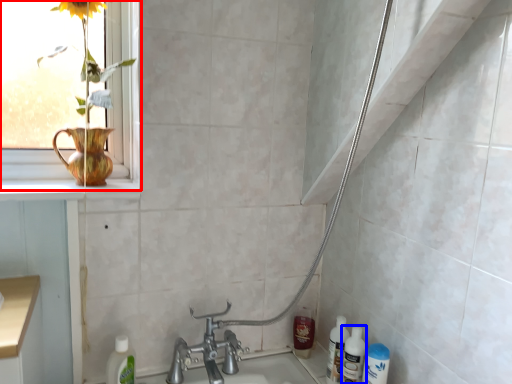
Question: Which object is further to the camera taking this photo, window (highlighted by a red box) or cleaning product (highlighted by a blue box)?

Choices:
 (A) window
 (B) cleaning product

Answer: (B)